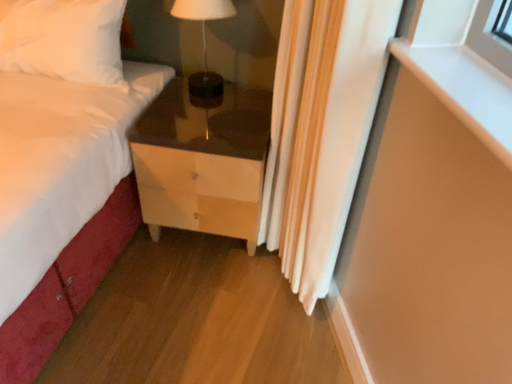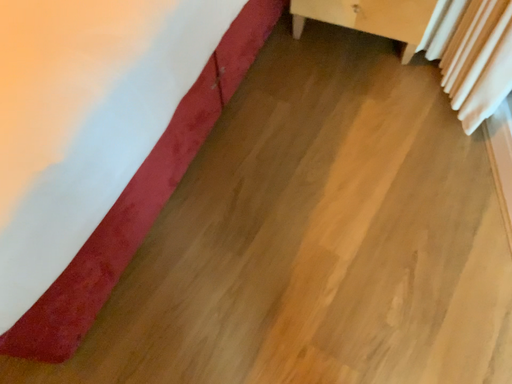
Question: Which way did the camera rotate in the video?

Choices:
 (A) rotated upward
 (B) rotated downward

Answer: (B)